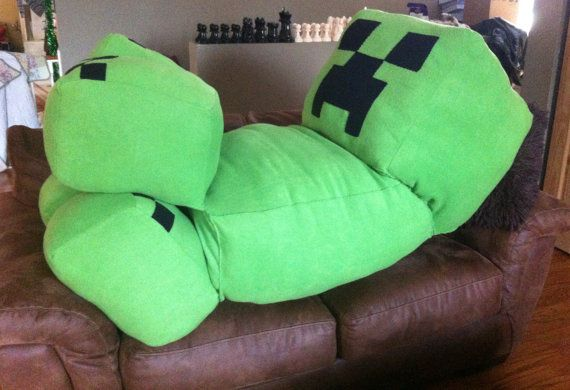
In order to click on minecraft pillow in this screenshot , I will do `click(289, 199)`.